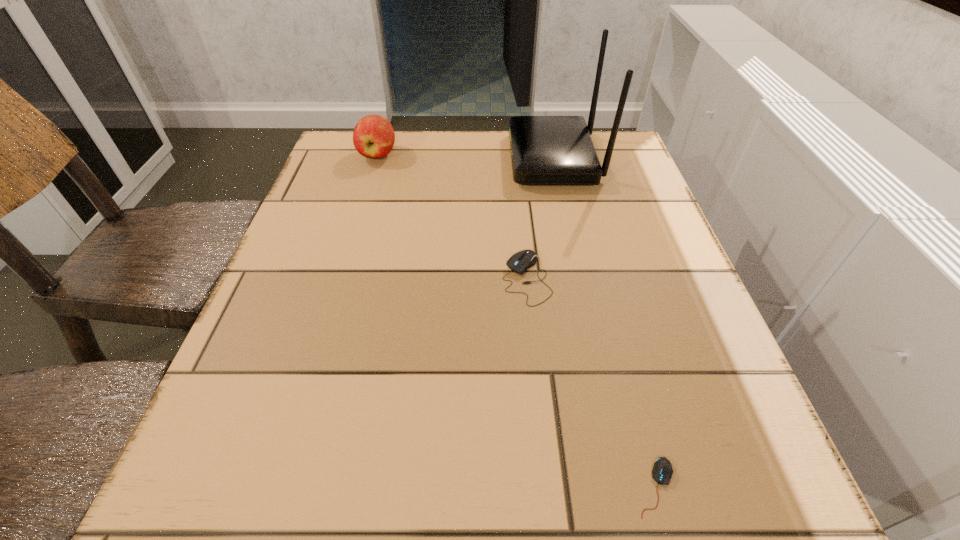
Where is `object located at the far right corner`? object located at the far right corner is located at coordinates (545, 150).

The width and height of the screenshot is (960, 540). I want to click on object that is positioned at the near right corner, so click(x=662, y=471).

Find the location of a particular element. Image resolution: width=960 pixels, height=540 pixels. blank space at the far edge is located at coordinates (467, 172).

In the image, there is a desktop. Identify the location of vacant space at the left edge. (324, 197).

Identify the location of free space at the right edge. (756, 438).

Identify the location of vacant space at the near left corner of the desktop. The width and height of the screenshot is (960, 540). click(200, 509).

Identify the location of free region at the far right corner of the desktop. The height and width of the screenshot is (540, 960). (611, 178).

The width and height of the screenshot is (960, 540). In the image, there is a desktop. What are the coordinates of `blank space at the near right corner` in the screenshot? It's located at (685, 508).

Where is `vacant space that is in between the shorter mouse and the router`? The image size is (960, 540). vacant space that is in between the shorter mouse and the router is located at coordinates (605, 323).

Find the location of a particular element. Image resolution: width=960 pixels, height=540 pixels. blank region between the third farthest object and the router is located at coordinates (540, 219).